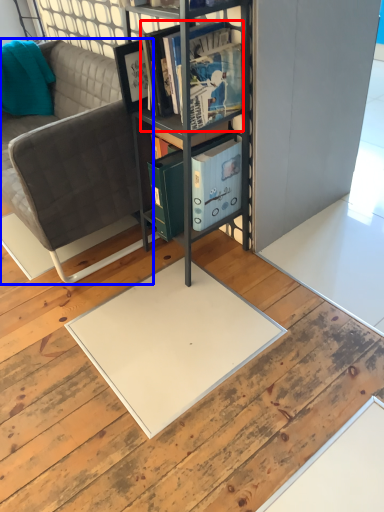
Question: Which object appears farthest to the camera in this image, book (highlighted by a red box) or studio couch (highlighted by a blue box)?

Choices:
 (A) book
 (B) studio couch

Answer: (B)